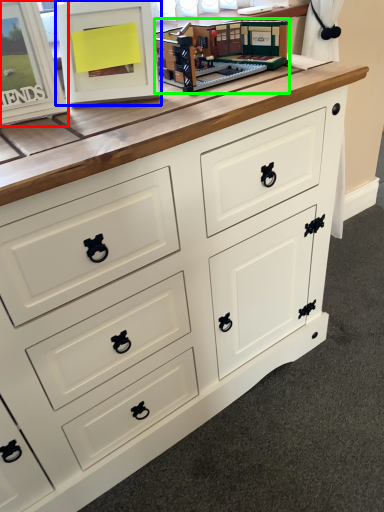
Question: Considering the real-world distances, which object is closest to picture frame (highlighted by a red box)? picture frame (highlighted by a blue box) or toy (highlighted by a green box).

Choices:
 (A) picture frame
 (B) toy

Answer: (A)